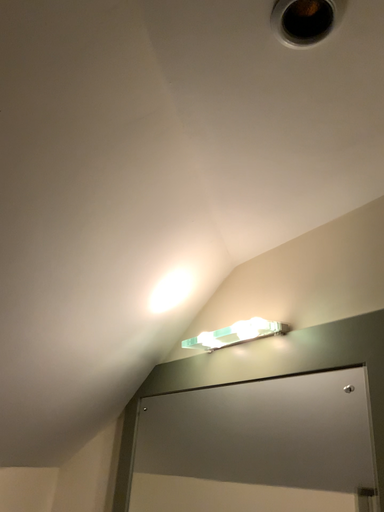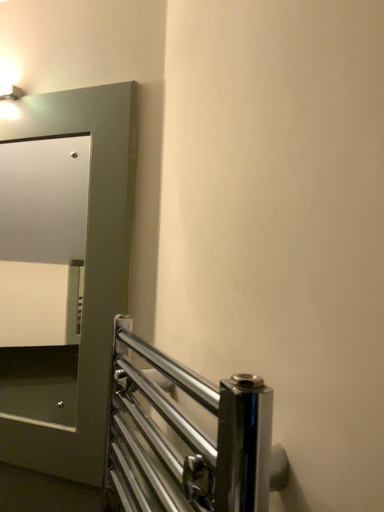
Question: Which way did the camera rotate in the video?

Choices:
 (A) rotated upward
 (B) rotated downward

Answer: (B)